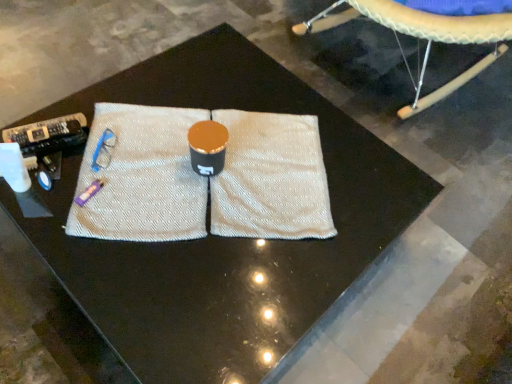
What do you see at coordinates (423, 37) in the screenshot? I see `beige leather cushion at upper right` at bounding box center [423, 37].

Locate an element on the screen. beige leather cushion at upper right is located at coordinates (423, 37).

The image size is (512, 384). Describe the element at coordinates (204, 178) in the screenshot. I see `white textured yoga mat at center` at that location.

What is the approximate height of white textured yoga mat at center?

→ white textured yoga mat at center is 1.44 inches tall.

I want to click on white textured yoga mat at center, so click(x=204, y=178).

You are a GUI agent. You are given a task and a screenshot of the screen. Output one action in this format:
    pyautogui.click(x=<x>, y=<y>)
    Task: Click on the beige leather cushion at upper right
    The height and width of the screenshot is (384, 512).
    Given the screenshot: What is the action you would take?
    pyautogui.click(x=423, y=37)

Is white textured yoga mat at center at the right side of beige leather cushion at upper right?

No, white textured yoga mat at center is not to the right of beige leather cushion at upper right.

Considering their positions, is white textured yoga mat at center located in front of or behind beige leather cushion at upper right?

Visually, white textured yoga mat at center is located in front of beige leather cushion at upper right.

Which is in front, point (105, 238) or point (457, 25)?

The point (105, 238) is closer.

From the image's perspective, which is below, white textured yoga mat at center or beige leather cushion at upper right?

From the image's view, white textured yoga mat at center is below.

From a real-world perspective, is white textured yoga mat at center physically below beige leather cushion at upper right?

Yes.

In terms of width, does white textured yoga mat at center look wider or thinner when compared to beige leather cushion at upper right?

Considering their sizes, white textured yoga mat at center looks slimmer than beige leather cushion at upper right.

Is white textured yoga mat at center shorter than beige leather cushion at upper right?

Yes.

Is white textured yoga mat at center smaller than beige leather cushion at upper right?

Yes, white textured yoga mat at center is smaller than beige leather cushion at upper right.

Could beige leather cushion at upper right be considered to be inside white textured yoga mat at center?

No, beige leather cushion at upper right is not surrounded by white textured yoga mat at center.

Would you consider white textured yoga mat at center to be distant from beige leather cushion at upper right?

They are positioned close to each other.

Is white textured yoga mat at center positioned with its back to beige leather cushion at upper right?

white textured yoga mat at center does not have its back to beige leather cushion at upper right.

How many degrees apart are the facing directions of white textured yoga mat at center and beige leather cushion at upper right?

There is a 54.2-degree angle between the facing directions of white textured yoga mat at center and beige leather cushion at upper right.

Find the location of a particular element. The image size is (512, 384). swivel chair located behind the white textured yoga mat at center is located at coordinates (423, 37).

Is beige leather cushion at upper right to the left or to the right of white textured yoga mat at center in the image?

Based on their positions, beige leather cushion at upper right is located to the right of white textured yoga mat at center.

Does beige leather cushion at upper right come in front of white textured yoga mat at center?

No, it is not.

Does point (417, 21) appear closer or farther from the camera than point (271, 189)?

Point (417, 21) appears to be farther away from the viewer than point (271, 189).

From the image's perspective, is beige leather cushion at upper right under white textured yoga mat at center?

No, from the image's perspective, beige leather cushion at upper right is not below white textured yoga mat at center.

From a real-world perspective, which is physically below, beige leather cushion at upper right or white textured yoga mat at center?

white textured yoga mat at center, from a real-world perspective.

Can you confirm if beige leather cushion at upper right is thinner than white textured yoga mat at center?

No.

Who is taller, beige leather cushion at upper right or white textured yoga mat at center?

With more height is beige leather cushion at upper right.

Which of these two, beige leather cushion at upper right or white textured yoga mat at center, is bigger?

beige leather cushion at upper right is bigger.

Can white textured yoga mat at center be found inside beige leather cushion at upper right?

No, white textured yoga mat at center is located outside of beige leather cushion at upper right.

Are beige leather cushion at upper right and white textured yoga mat at center making contact?

No, beige leather cushion at upper right is not making contact with white textured yoga mat at center.

Does beige leather cushion at upper right turn towards white textured yoga mat at center?

No, beige leather cushion at upper right is not oriented towards white textured yoga mat at center.

Measure the distance between beige leather cushion at upper right and white textured yoga mat at center.

A distance of 33.44 inches exists between beige leather cushion at upper right and white textured yoga mat at center.

In the image, there is a beige leather cushion at upper right. Where is `yoga mat below it (from the image's perspective)`? yoga mat below it (from the image's perspective) is located at coordinates (204, 178).

Identify the location of swivel chair that appears above the white textured yoga mat at center (from a real-world perspective). (423, 37).

Image resolution: width=512 pixels, height=384 pixels. Identify the location of yoga mat that is below the beige leather cushion at upper right (from the image's perspective). (204, 178).